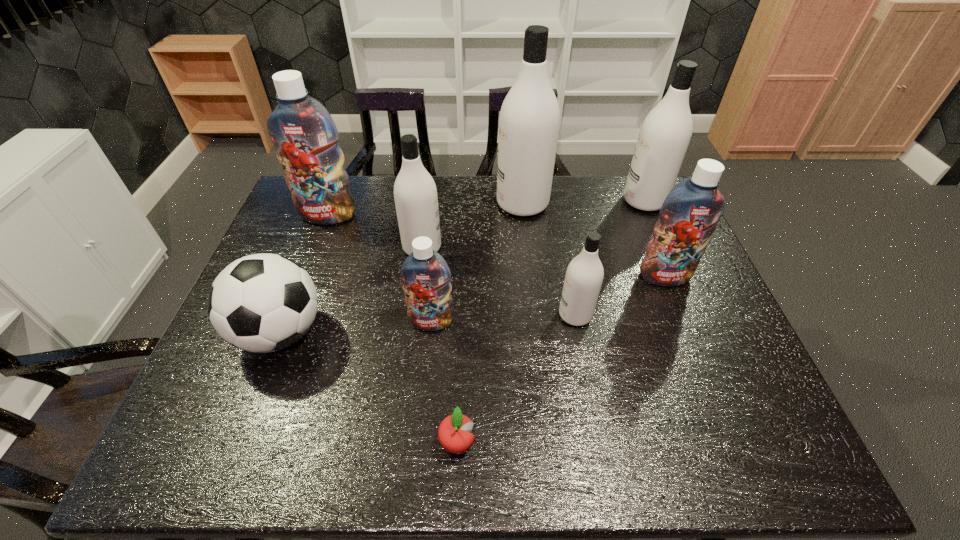
Find the location of a particular element. the tallest shampoo is located at coordinates 529,119.

At what (x,y) coordinates should I click in order to perform the action: click on the biggest white shampoo. Please return your answer as a coordinate pair (x, y). This screenshot has height=540, width=960. Looking at the image, I should click on (529, 119).

The height and width of the screenshot is (540, 960). Identify the location of the rightmost white shampoo. (665, 134).

Image resolution: width=960 pixels, height=540 pixels. What are the coordinates of `the farthest blue shampoo` in the screenshot? It's located at (305, 137).

Find the location of a particular element. The image size is (960, 540). the leftmost shampoo is located at coordinates (305, 137).

Where is `the second smallest white shampoo`? The height and width of the screenshot is (540, 960). the second smallest white shampoo is located at coordinates (415, 193).

Where is `the leftmost white shampoo`? Image resolution: width=960 pixels, height=540 pixels. the leftmost white shampoo is located at coordinates point(415,193).

Where is `the second farthest blue shampoo`? This screenshot has height=540, width=960. the second farthest blue shampoo is located at coordinates (689, 215).

Locate an element on the screen. the fifth farthest object is located at coordinates [689, 215].

Locate an element on the screen. The image size is (960, 540). the nearest white shampoo is located at coordinates (584, 275).